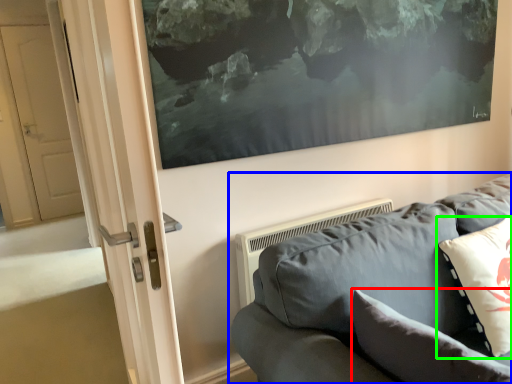
Question: Considering the real-world distances, which object is farthest from pillow (highlighted by a red box)? studio couch (highlighted by a blue box) or pillow (highlighted by a green box)?

Choices:
 (A) studio couch
 (B) pillow

Answer: (B)